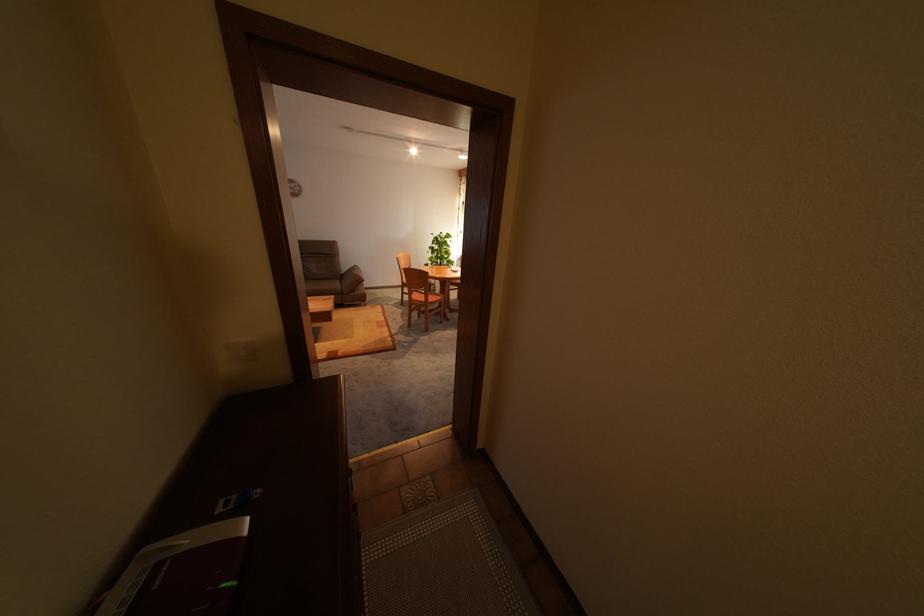
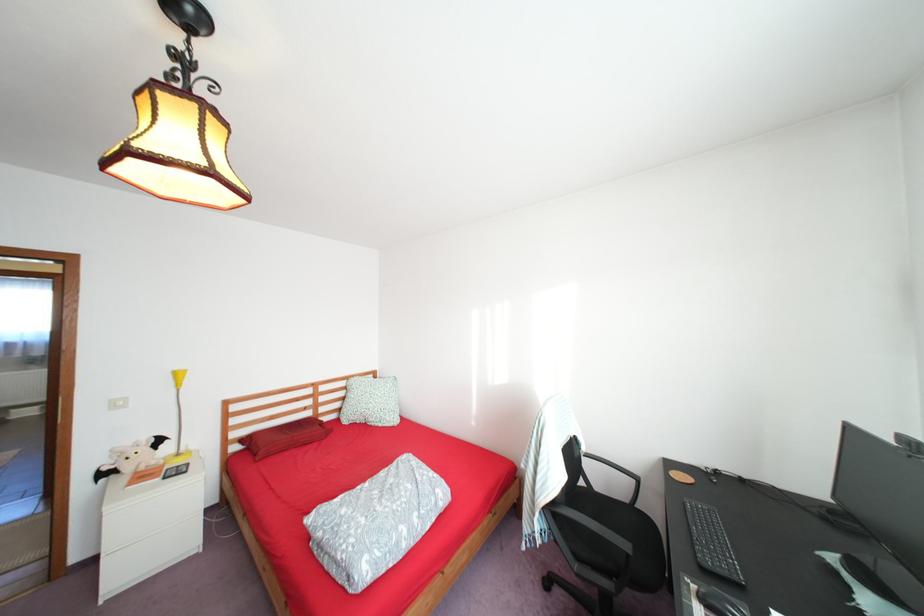
Question: I am providing you with two images of the same scene from different viewpoints. Which of the following objects are not visible in image2?

Choices:
 (A) small blue object
 (B) patterned square pillow
 (C) black computer mouse
 (D) clear pitcher handle

Answer: (A)